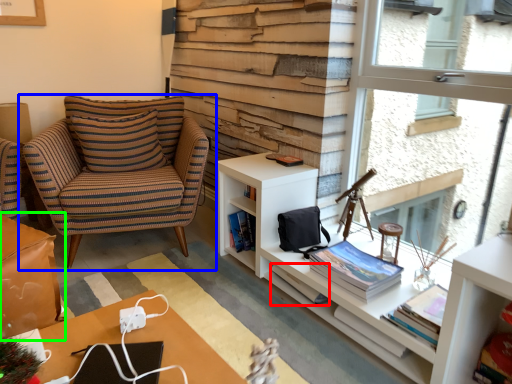
Question: Which object is the closest to the book (highlighted by a red box)? Choose among these: chair (highlighted by a blue box) or table (highlighted by a green box).

Choices:
 (A) chair
 (B) table

Answer: (B)